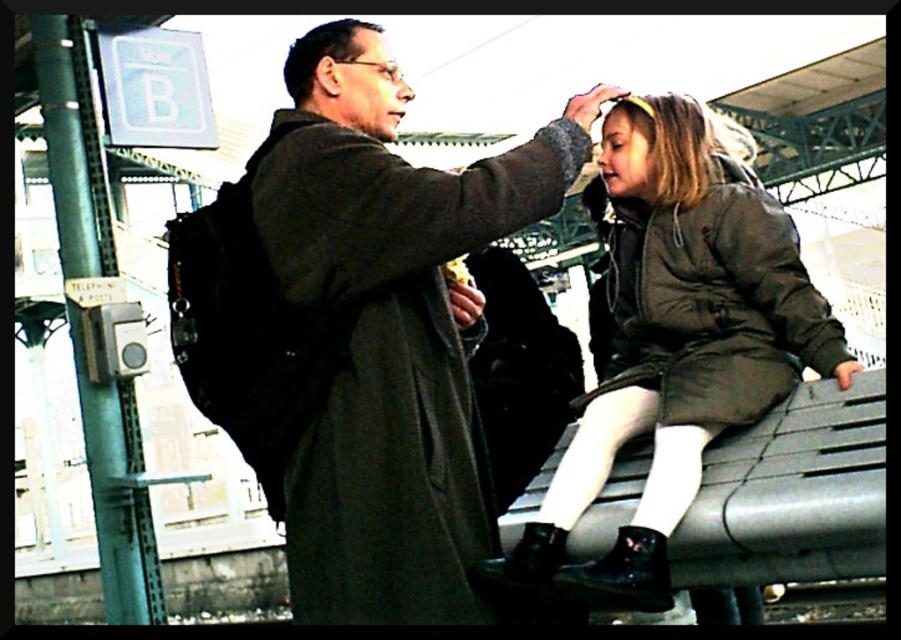
Between dark green matte coat at center and matte black coat at center, which one is positioned higher?

Positioned higher is dark green matte coat at center.

Is dark green matte coat at center shorter than matte black coat at center?

Yes.

Is point (665, 225) less distant than point (484, 275)?

Yes, it is.

The width and height of the screenshot is (901, 640). Find the location of `dark green matte coat at center`. dark green matte coat at center is located at coordinates (713, 305).

Is dark green jacket at center thinner than matte black coat at center?

Incorrect, dark green jacket at center's width is not less than matte black coat at center's.

Is the position of dark green jacket at center less distant than that of matte black coat at center?

That is True.

Who is more forward, (690, 161) or (553, 432)?

Point (690, 161) is more forward.

Locate an element on the screen. The image size is (901, 640). dark green jacket at center is located at coordinates (677, 339).

Between matte black coat at center and matte black forehead at upper center, which one appears on the left side from the viewer's perspective?

Positioned to the left is matte black forehead at upper center.

Locate an element on the screen. This screenshot has width=901, height=640. matte black coat at center is located at coordinates (520, 371).

At what (x,y) coordinates should I click in order to perform the action: click on matte black coat at center. Please return your answer as a coordinate pair (x, y). The height and width of the screenshot is (640, 901). Looking at the image, I should click on (520, 371).